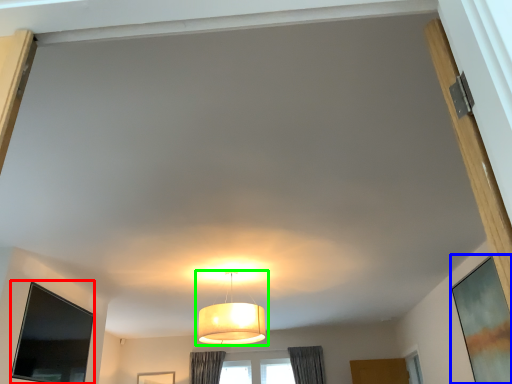
Question: Estimate the real-world distances between objects in this image. Which object is closer to window screen (highlighted by a red box), window screen (highlighted by a blue box) or lamp (highlighted by a green box)?

Choices:
 (A) window screen
 (B) lamp

Answer: (B)